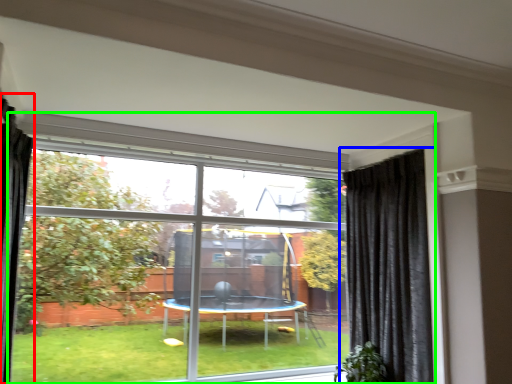
Question: Estimate the real-world distances between objects in this image. Which object is farther from curtain (highlighted by a red box), curtain (highlighted by a blue box) or window (highlighted by a green box)?

Choices:
 (A) curtain
 (B) window

Answer: (A)